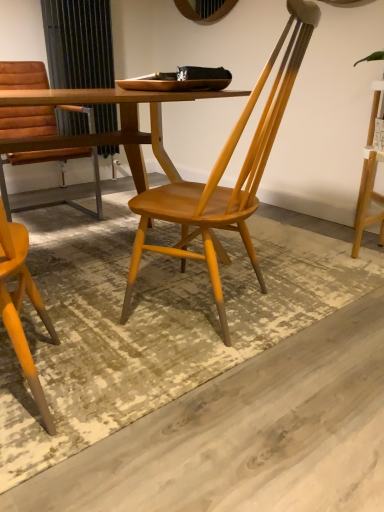
Question: Considering the relative positions of wooden chair at center, arranged as the 2th chair when viewed from the back, and matte brown leather chair at left, acting as the 1th chair starting from the back, in the image provided, is wooden chair at center, arranged as the 2th chair when viewed from the back, to the left or to the right of matte brown leather chair at left, acting as the 1th chair starting from the back,?

Choices:
 (A) left
 (B) right

Answer: (B)

Question: Looking at their shapes, would you say wooden chair at center, which is the first chair in front-to-back order, is wider or thinner than matte brown leather chair at left, acting as the 2th chair starting from the right?

Choices:
 (A) wide
 (B) thin

Answer: (B)

Question: Which object is positioned farthest from the wooden chair at center, arranged as the 2th chair when viewed from the back?

Choices:
 (A) matte brown leather chair at left, acting as the 2th chair starting from the right
 (B) wooden table at center

Answer: (A)

Question: Based on their relative distances, which object is nearer to the wooden table at center?

Choices:
 (A) matte brown leather chair at left, acting as the 2th chair starting from the right
 (B) wooden chair at center, which is the first chair in front-to-back order

Answer: (B)